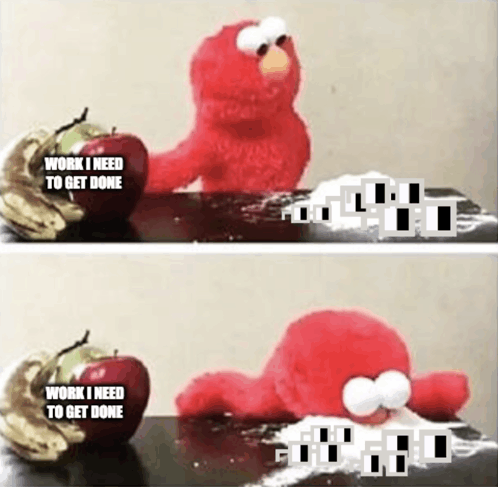
What are the coordinates of `wall` in the screenshot? It's located at (447, 336), (439, 279), (236, 282), (179, 348), (48, 297).